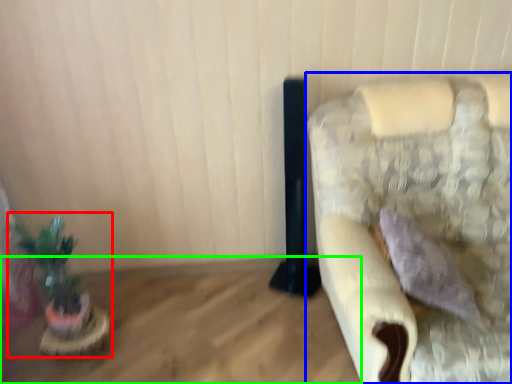
Question: Based on their relative distances, which object is farther from houseplant (highlighted by a red box)? Choose from furniture (highlighted by a blue box) and table (highlighted by a green box).

Choices:
 (A) furniture
 (B) table

Answer: (A)